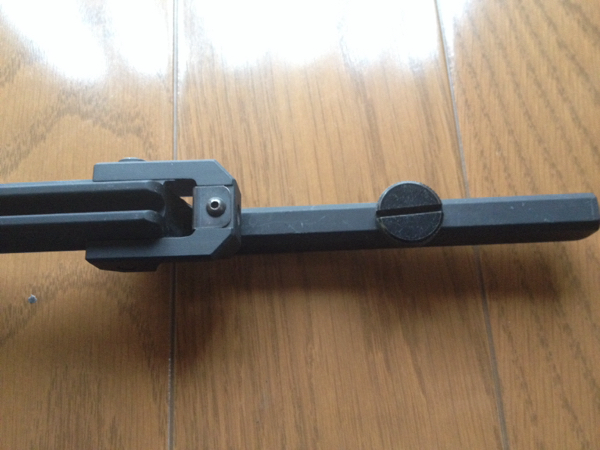
You are a GUI agent. You are given a task and a screenshot of the screen. Output one action in this format:
    pyautogui.click(x=<x>, y=<y>)
    Task: Click on the lightbulb
    
    Given the screenshot: What is the action you would take?
    pyautogui.click(x=538, y=444)